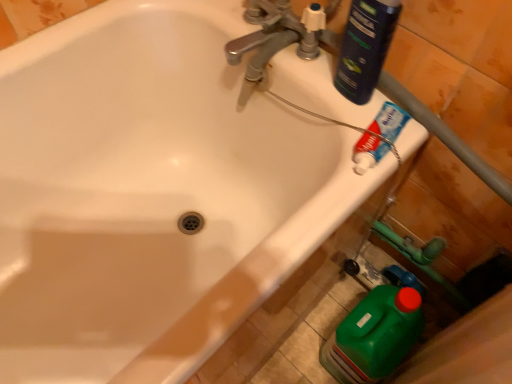
I want to click on free spot behind white glossy toothpaste at upper right, so click(x=330, y=88).